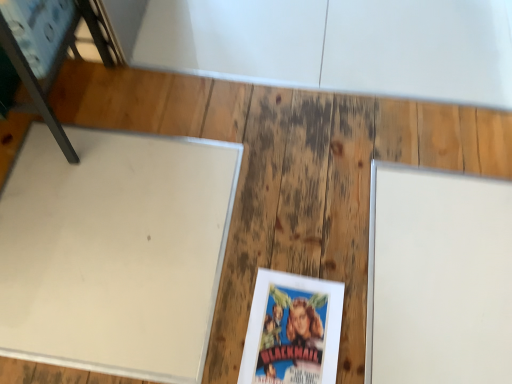
Where is `vacant region above white matte board at left (from a real-world perspective)`? This screenshot has height=384, width=512. vacant region above white matte board at left (from a real-world perspective) is located at coordinates (111, 233).